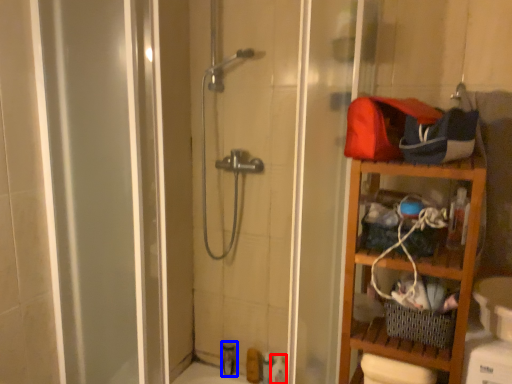
Question: Which point is closer to the camera, toiletry (highlighted by a red box) or toiletry (highlighted by a blue box)?

Choices:
 (A) toiletry
 (B) toiletry

Answer: (A)